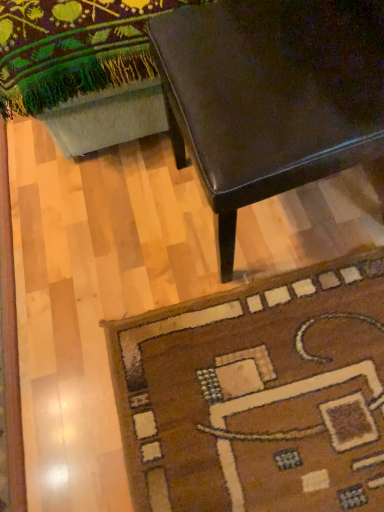
Find the location of a particular element. The height and width of the screenshot is (512, 384). blank space situated above brown woolen rug at lower right (from a real-world perspective) is located at coordinates (269, 373).